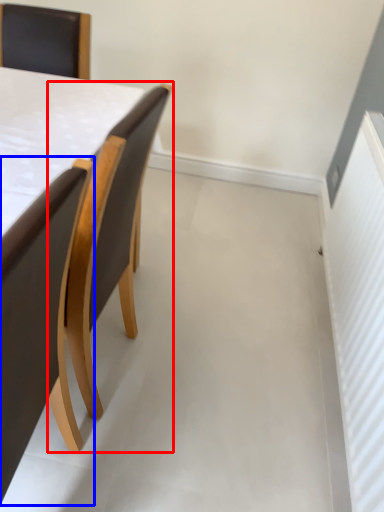
Question: Which of the following is the farthest to the observer, chair (highlighted by a red box) or chair (highlighted by a blue box)?

Choices:
 (A) chair
 (B) chair

Answer: (A)